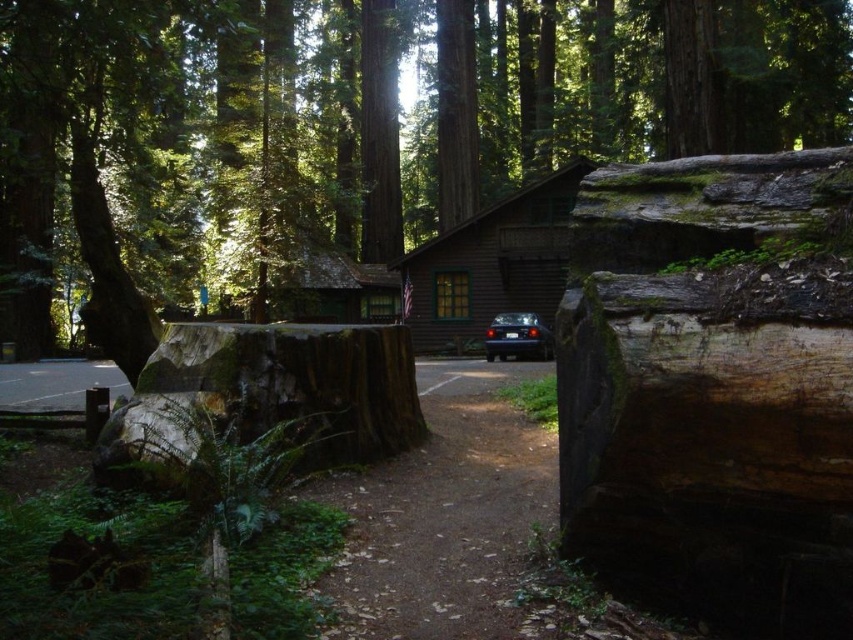
You are standing in the forest near the smooth brown tree trunk at left and the metallic blue car at center. If you want to walk from the tree trunk to the car, which direction should you move relative to the tree trunk?

You should move towards the center from the smooth brown tree trunk at left to reach the metallic blue car at center because the tree trunk is positioned over the car.

In the scene shown: You are planning to move the metallic blue car at center to a parking spot 10 meters away. Can the smooth bark log at center be used as a ramp to move the car over a small hill?

The smooth bark log at center is larger in size than the metallic blue car at center, so it can be used as a ramp to move the car over the small hill.